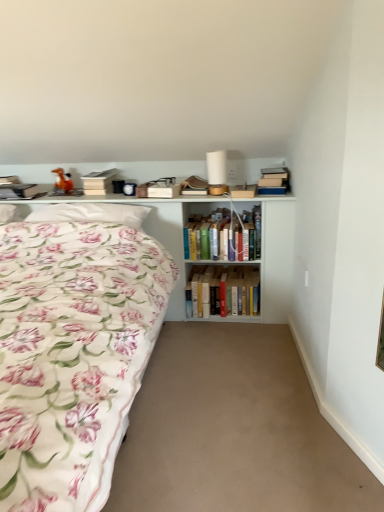
I want to click on free spot in front of white matte paperback book at upper center, which is the third paperback book in right-to-left order, so click(105, 193).